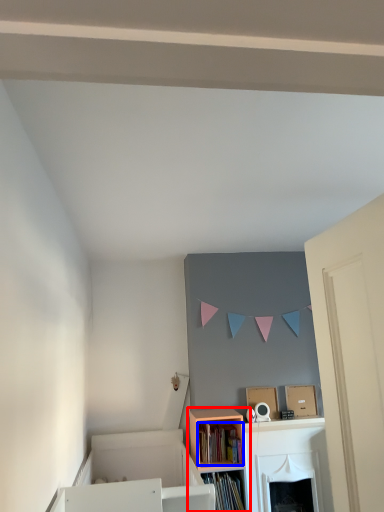
Question: Which object is closer to the camera taking this photo, shelf (highlighted by a red box) or book (highlighted by a blue box)?

Choices:
 (A) shelf
 (B) book

Answer: (A)